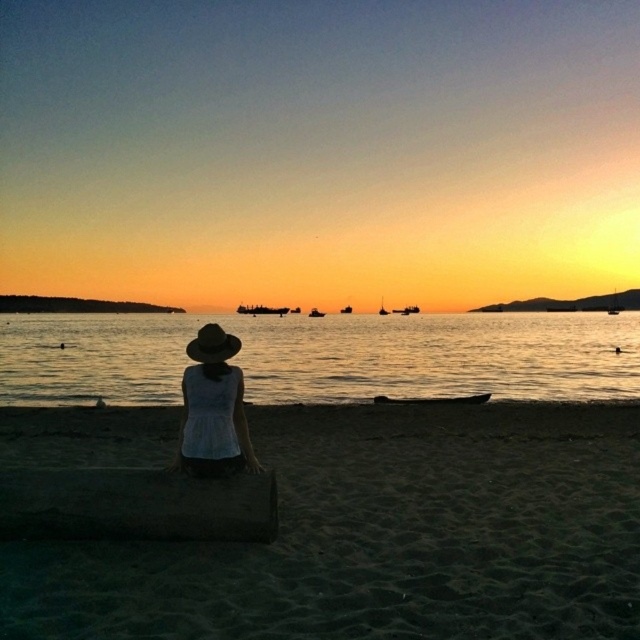
In the scene shown: You are a photographer trying to capture the sunset scene. You want to place your tripod exactly where the white matte hat at center is currently located. According to the coordinates provided, what are the exact coordinates where you should set up your tripod?

The exact coordinates for setting up the tripod are at point (212, 408) where the white matte hat at center is located.

You are standing on the beach and see the white matte hat at center and the metallic gray ship at center. Which object is positioned more to the east? Please explain based on their locations relative to each other and the sunset direction.

The metallic gray ship at center is positioned more to the east because the sunset occurs in the west, and the white matte hat at center is to the right of the metallic gray ship at center. Since the sun sets in the west, the right side of the ship would be facing east, making the ship itself closer to the eastern direction compared to the hat.

You are standing on the beach and want to take a photo of the metallic silver boat at center. To ensure the boat is clearly visible in the photo, should you move closer to or further away from the translucent water at center?

A: The translucent water at center is in front of the metallic silver boat at center, so to ensure the boat is clearly visible, you should move further away from the translucent water at center to get a clearer view of the boat.